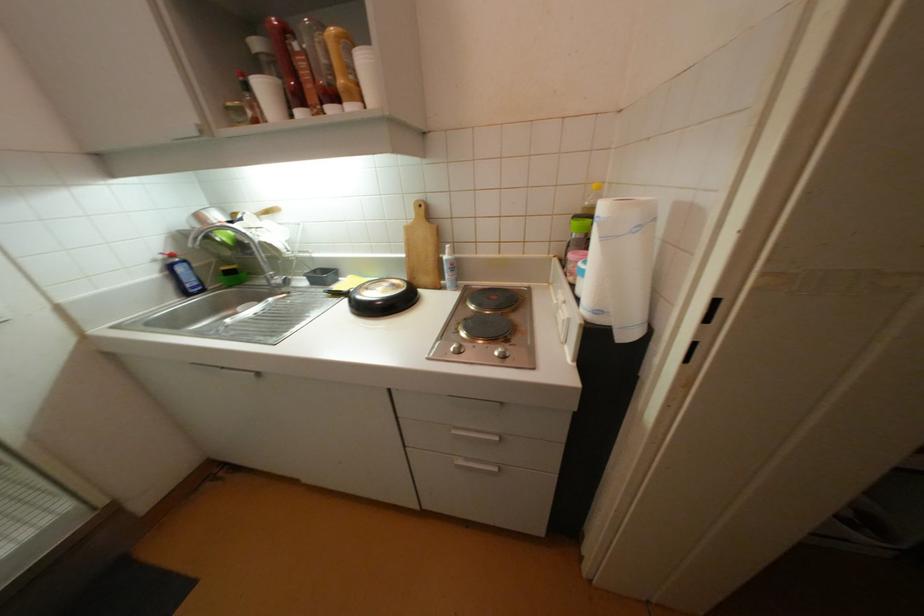
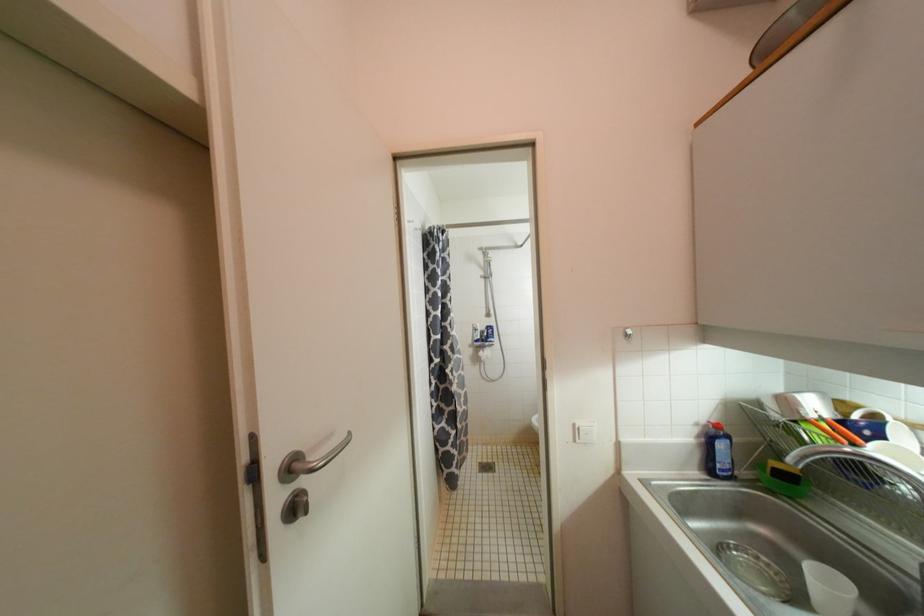
Question: How did the camera likely rotate?

Choices:
 (A) Left
 (B) Right
 (C) Up
 (D) Down

Answer: (A)